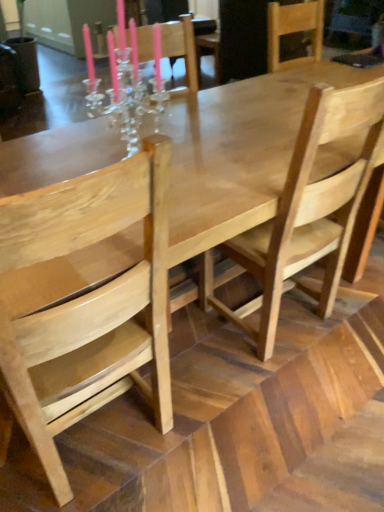
Question: Looking at their shapes, would you say light brown wood chair at center, the 1th chair when ordered from right to left, is wider or thinner than natural wood chair at left, which is the 1th chair in left-to-right order?

Choices:
 (A) wide
 (B) thin

Answer: (B)

Question: Considering the positions of light brown wood chair at center, which is counted as the second chair, starting from the left, and natural wood chair at left, which is the second chair from right to left, in the image, is light brown wood chair at center, which is counted as the second chair, starting from the left, taller or shorter than natural wood chair at left, which is the second chair from right to left,?

Choices:
 (A) tall
 (B) short

Answer: (A)

Question: Is light brown wood chair at center, which is counted as the second chair, starting from the left, to the left or to the right of natural wood chair at left, which is the 1th chair in left-to-right order, in the image?

Choices:
 (A) right
 (B) left

Answer: (A)

Question: Considering the relative positions of natural wood chair at left, which is the second chair from right to left, and light brown wood chair at center, the 1th chair when ordered from right to left, in the image provided, is natural wood chair at left, which is the second chair from right to left, to the left or to the right of light brown wood chair at center, the 1th chair when ordered from right to left,?

Choices:
 (A) left
 (B) right

Answer: (A)

Question: Considering their positions, is natural wood chair at left, which is the 1th chair in left-to-right order, located in front of or behind light brown wood chair at center, which is counted as the second chair, starting from the left?

Choices:
 (A) front
 (B) behind

Answer: (A)

Question: In terms of height, does natural wood chair at left, which is the second chair from right to left, look taller or shorter compared to light brown wood chair at center, the 1th chair when ordered from right to left?

Choices:
 (A) short
 (B) tall

Answer: (A)

Question: From the image's perspective, is natural wood chair at left, which is the second chair from right to left, above or below light brown wood chair at center, which is counted as the second chair, starting from the left?

Choices:
 (A) above
 (B) below

Answer: (B)